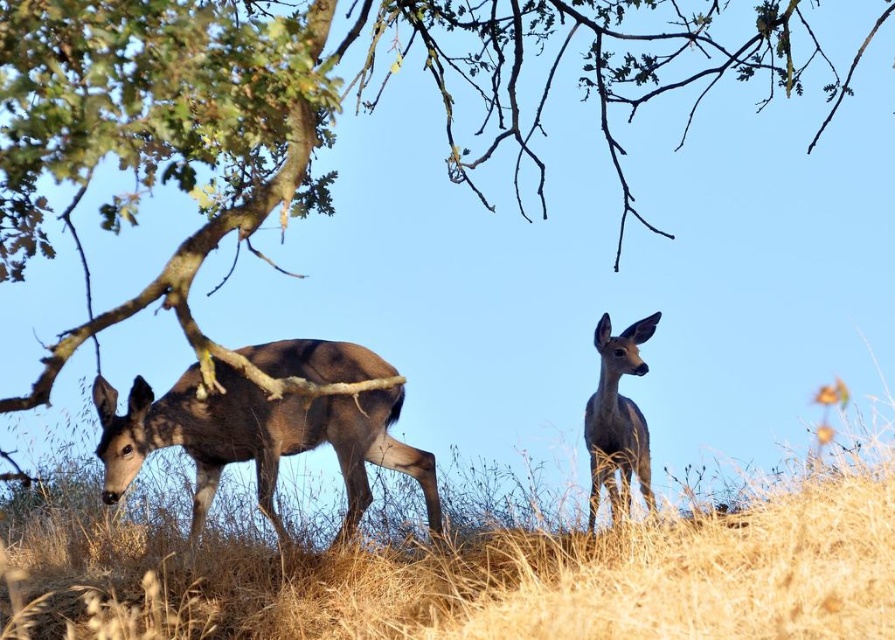
Question: Can you confirm if brown matte deer at left is positioned to the right of brown fur roe deer at center?

Choices:
 (A) yes
 (B) no

Answer: (B)

Question: Does brown matte deer at left appear under brown fur roe deer at center?

Choices:
 (A) yes
 (B) no

Answer: (A)

Question: Which of the following is the closest to the observer?

Choices:
 (A) brown matte deer at left
 (B) brown fur roe deer at center

Answer: (B)

Question: Can you confirm if brown matte deer at left is positioned above brown fur roe deer at center?

Choices:
 (A) no
 (B) yes

Answer: (A)

Question: Among these objects, which one is nearest to the camera?

Choices:
 (A) brown fur roe deer at center
 (B) brown matte deer at left

Answer: (A)